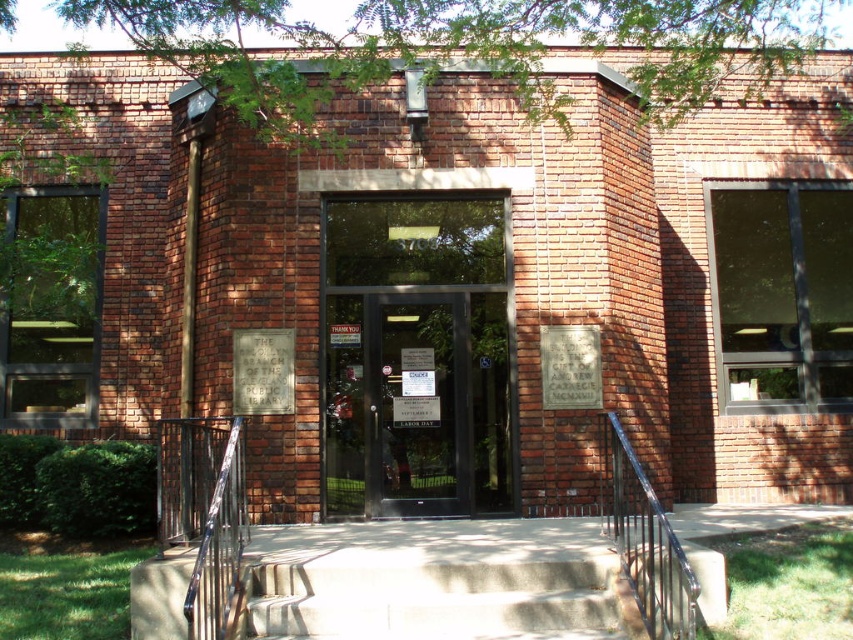
You are a delivery person trying to enter the library branch. You have a heavy box that requires a clear path to the entrance doors. Are the transparent glass door at center and the concrete stairs at center arranged in a way that allows you to move the box straight to the doors without needing to navigate around any obstacles?

The transparent glass door at center is positioned over concrete stairs at center, so the stairs are below the doors. This means there is a clear path straight to the doors, allowing you to move the box directly without needing to navigate around obstacles.

You are a delivery person with a 1.2 meter wide package. You need to bring it into the library. Can the transparent glass door at center and the concrete stairs at center accommodate the package? Please explain your reasoning based on their dimensions.

The transparent glass door at center is thinner than the concrete stairs at center. Since the package is 1.2 meters wide, the door may not be wide enough, but the stairs might have sufficient width. However, without exact measurements, it is uncertain. The answer depends on the actual widths of both structures.